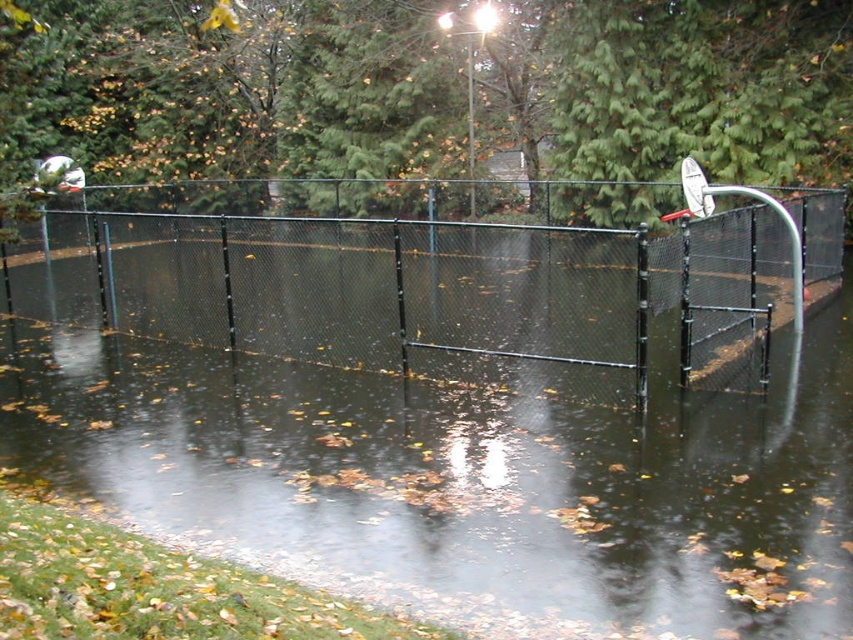
You are standing on the flooded basketball court and want to throw a ball to the hoop. Considering the positions of the transparent water at center and the white matte basketball hoop at upper right, which object is closer to you when you aim?

The transparent water at center is closer to the viewer than the white matte basketball hoop at upper right, so you should aim towards the white matte basketball hoop at upper right as it is farther away.

Consider the image. You are standing on the flooded basketball court and want to reach a point closer to you. Which point should you head towards, point (339, 227) or point (682, 172)?

You should head towards point (339, 227) because it is closer to the viewer than point (682, 172).